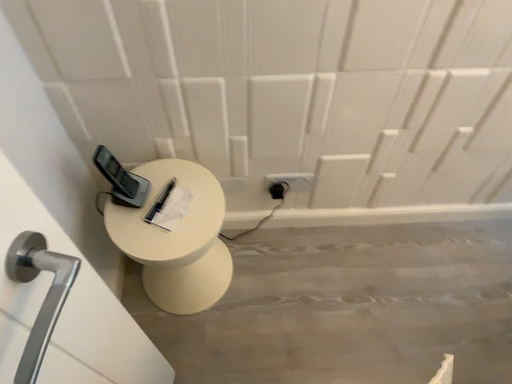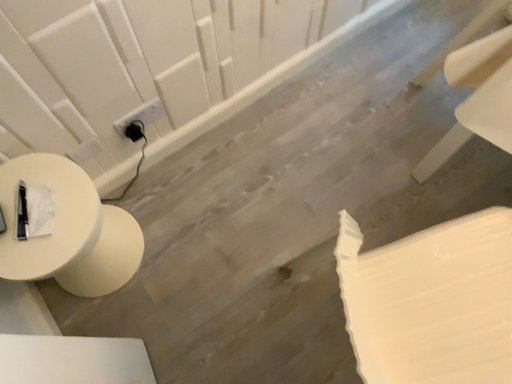
Question: Which way did the camera rotate in the video?

Choices:
 (A) rotated downward
 (B) rotated upward

Answer: (A)